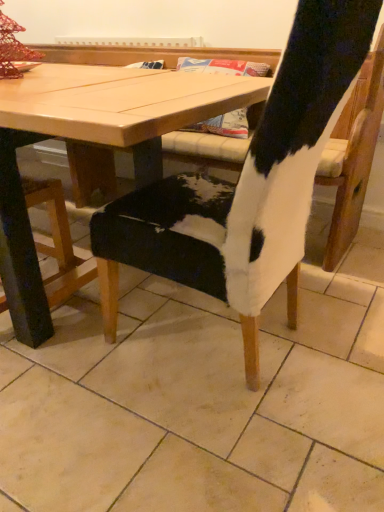
Where is `vacant area to the right of cowhide chair at center`? The height and width of the screenshot is (512, 384). vacant area to the right of cowhide chair at center is located at coordinates (338, 332).